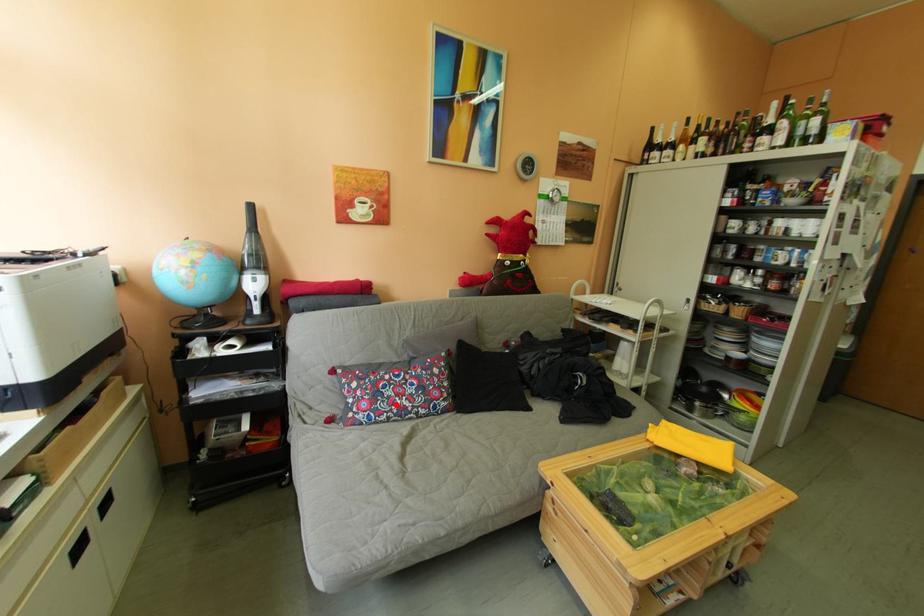
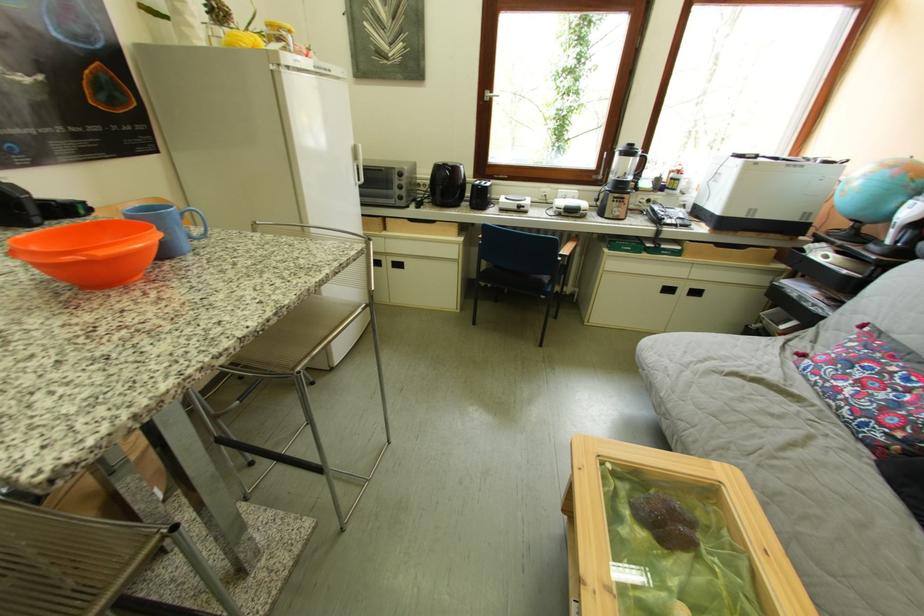
Find the pixel in the second image that matches the highlighted location in the first image.

(849, 374)